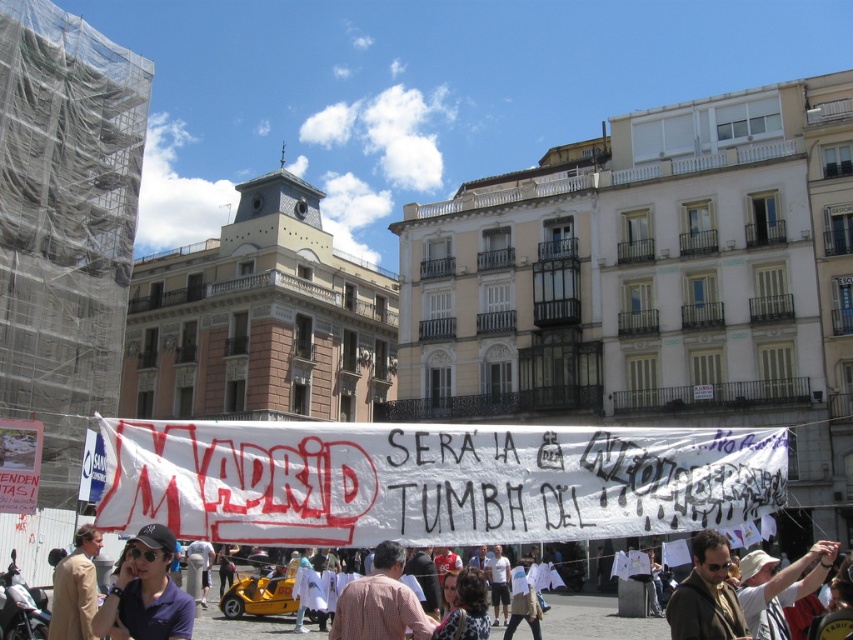
Question: Which object is the closest to the plaid shirt at center?

Choices:
 (A) beige wool coat at lower left
 (B) dark blue fabric cap at lower left

Answer: (B)

Question: Where is dark blue fabric cap at lower left located in relation to beige wool coat at lower left in the image?

Choices:
 (A) left
 (B) right

Answer: (B)

Question: Can you confirm if dark blue fabric cap at lower left is wider than beige wool coat at lower left?

Choices:
 (A) yes
 (B) no

Answer: (B)

Question: Which object appears farthest from the camera in this image?

Choices:
 (A) beige wool coat at lower left
 (B) plaid shirt at center

Answer: (A)

Question: Among these points, which one is farthest from the camera?

Choices:
 (A) (77, 548)
 (B) (102, 632)
 (C) (364, 598)

Answer: (A)

Question: Does dark blue fabric cap at lower left appear on the left side of beige wool coat at lower left?

Choices:
 (A) yes
 (B) no

Answer: (B)